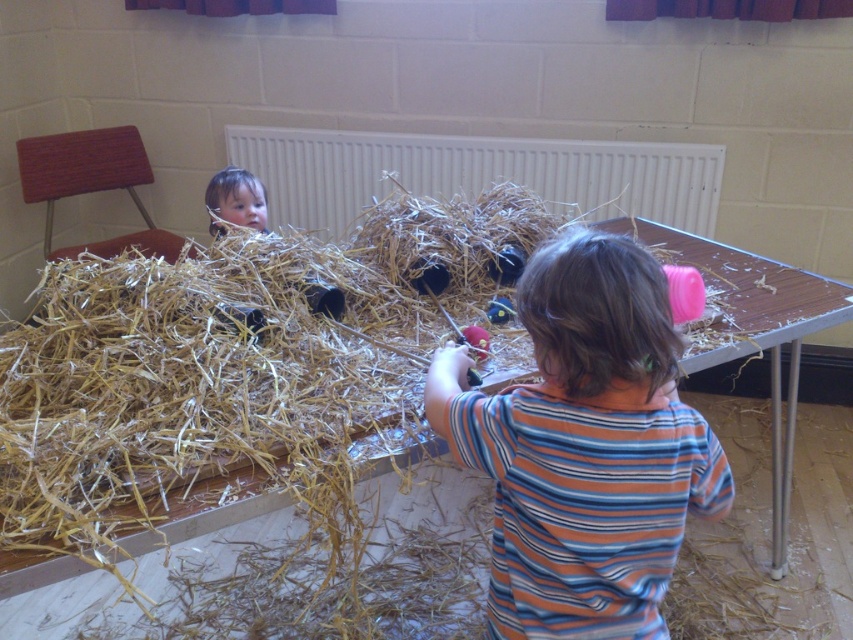
You are a parent observing your children crafting at the table. You notice the natural straw at center and the striped cotton shirt at center. Which object is taller?

The natural straw at center is taller than the striped cotton shirt at center.

You are a parent trying to clean up the craft area. The natural straw at center is blocking the white matte radiator at upper center. Can you tell me if the straw is taller than the radiator?

The natural straw at center is much taller than the white matte radiator at upper center, so yes, the straw is taller than the radiator.